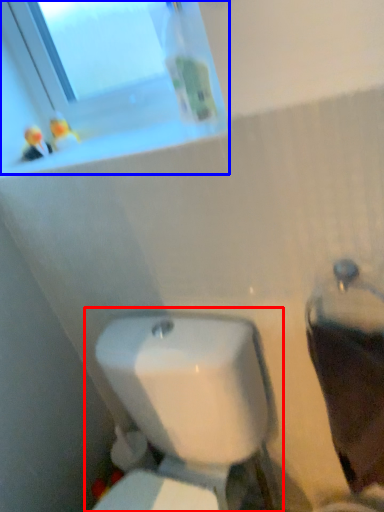
Question: Which object is closer to the camera taking this photo, toilet (highlighted by a red box) or window (highlighted by a blue box)?

Choices:
 (A) toilet
 (B) window

Answer: (A)